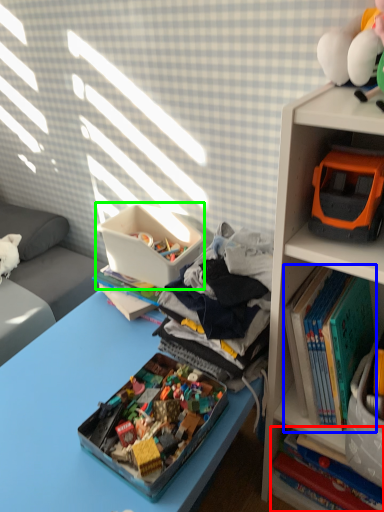
Question: Estimate the real-world distances between objects in this image. Which object is farther from book (highlighted by a red box), book (highlighted by a blue box) or storage box (highlighted by a green box)?

Choices:
 (A) book
 (B) storage box

Answer: (B)